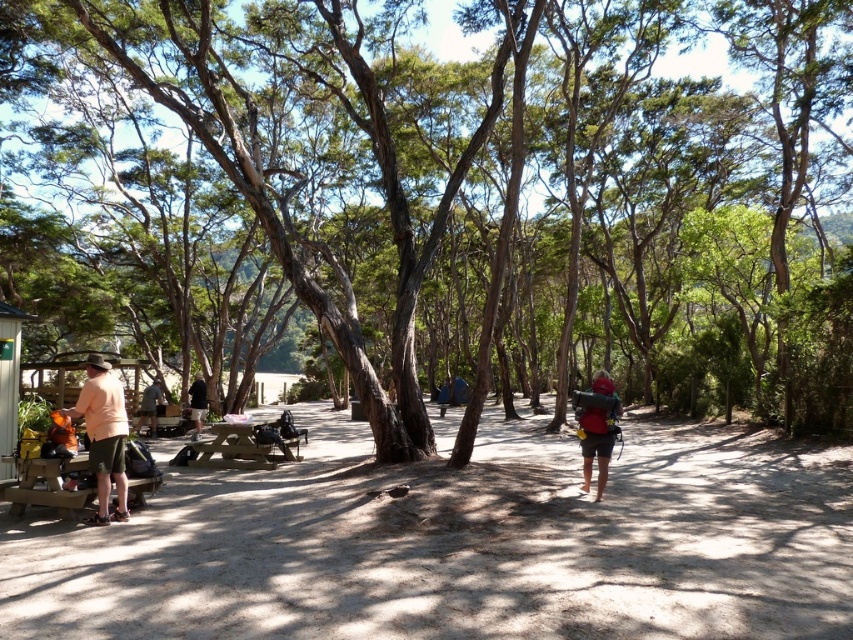
Question: Is wooden picnic table at center to the right of dark brown leather backpack at center from the viewer's perspective?

Choices:
 (A) yes
 (B) no

Answer: (A)

Question: Which of the following is the farthest from the observer?

Choices:
 (A) (190, 413)
 (B) (247, 74)
 (C) (601, 467)
 (D) (234, 444)

Answer: (B)

Question: Which of the following is the farthest from the observer?

Choices:
 (A) (473, 436)
 (B) (102, 518)

Answer: (A)

Question: Is dark gray backpack at center wider than dark brown leather backpack at center?

Choices:
 (A) yes
 (B) no

Answer: (B)

Question: Which point is closer to the camera?

Choices:
 (A) (601, 428)
 (B) (254, 468)
 (C) (68, 492)
 (D) (141, 406)

Answer: (C)

Question: Does brown wooden bench at lower left appear on the left side of matte red backpack at center?

Choices:
 (A) yes
 (B) no

Answer: (A)